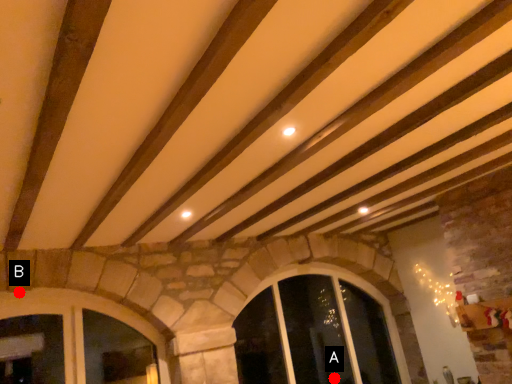
Question: Two points are circled on the image, labeled by A and B beside each circle. Which point is farther to the camera?

Choices:
 (A) A is further
 (B) B is further

Answer: (A)